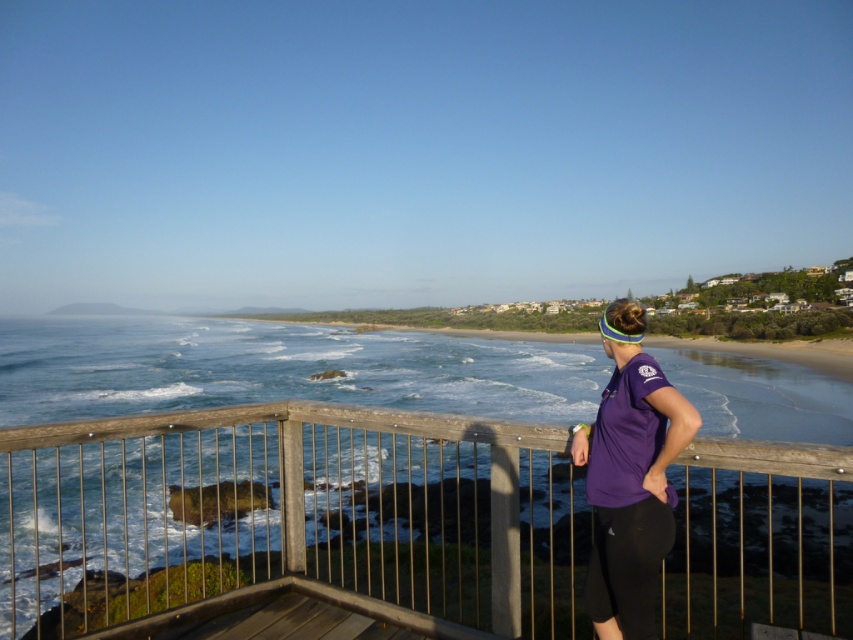
You are standing on the wooden deck and want to take a photo of the ocean. The wooden railing at center and the purple fabric shirt at center are both in your view. Which object is taller in the image?

The wooden railing at center is much taller than the purple fabric shirt at center.

You are standing on the wooden deck and want to place a small potted plant exactly at the center of the wooden railing at center. According to the coordinates provided, what are the coordinates where you should place the plant?

The coordinates for the wooden railing at center are at point (291, 515), so you should place the plant at those coordinates.